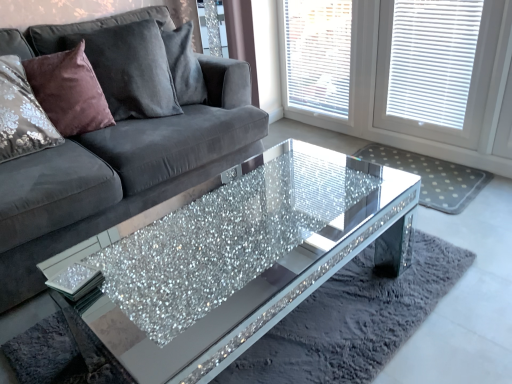
Find the location of `white mesh screen at upper right`. white mesh screen at upper right is located at coordinates (318, 55).

Image resolution: width=512 pixels, height=384 pixels. What do you see at coordinates (232, 258) in the screenshot? I see `sparkly glass coffee table at center` at bounding box center [232, 258].

The width and height of the screenshot is (512, 384). Find the location of `sparkly glass coffee table at center`. sparkly glass coffee table at center is located at coordinates (232, 258).

Where is `white textured blinds at upper right`? The height and width of the screenshot is (384, 512). white textured blinds at upper right is located at coordinates (388, 80).

Describe the element at coordinates (388, 80) in the screenshot. The width and height of the screenshot is (512, 384). I see `white textured blinds at upper right` at that location.

You are a GUI agent. You are given a task and a screenshot of the screen. Output one action in this format:
    pyautogui.click(x=<x>, y=<y>)
    Task: Click on the velvet grey couch at center
    
    Given the screenshot: What is the action you would take?
    pyautogui.click(x=123, y=141)

Find the location of a particular element. white mesh screen at upper right is located at coordinates (318, 55).

Is white textured blind at upper right at the right side of white textured blinds at upper right?

Indeed, white textured blind at upper right is positioned on the right side of white textured blinds at upper right.

Is point (457, 2) positioned behind point (510, 19)?

Yes, it is behind point (510, 19).

Are white textured blind at upper right and white textured blinds at upper right located far from each other?

That's not correct — white textured blind at upper right is a little close to white textured blinds at upper right.

From a real-world perspective, is white mesh screen at upper right physically below white textured blinds at upper right?

No, from a real-world perspective, white mesh screen at upper right is not under white textured blinds at upper right.

Between white mesh screen at upper right and white textured blinds at upper right, which one has larger width?

Wider between the two is white textured blinds at upper right.

Can we say white mesh screen at upper right lies outside white textured blinds at upper right?

Yes, white mesh screen at upper right is not within white textured blinds at upper right.

How many degrees apart are the facing directions of white mesh screen at upper right and white textured blinds at upper right?

There is a 1.18-degree angle between the facing directions of white mesh screen at upper right and white textured blinds at upper right.

Starting from the sparkly glass coffee table at center, which pillow is the 2nd one behind? Please provide its 2D coordinates.

[(121, 64)]

Considering the positions of objects sparkly glass coffee table at center and velvet/maroon pillow at left, the 2th pillow viewed from the left, in the image provided, who is in front, sparkly glass coffee table at center or velvet/maroon pillow at left, the 2th pillow viewed from the left,?

Positioned in front is sparkly glass coffee table at center.

Which point is more forward, [397,242] or [135,108]?

The point [397,242] is more forward.

Which object is thinner, sparkly glass coffee table at center or velvet/maroon pillow at left, which is the 1th pillow in right-to-left order?

velvet/maroon pillow at left, which is the 1th pillow in right-to-left order, is thinner.

From the picture: From the image's perspective, is white textured blind at upper right below sparkly glass coffee table at center?

No, from the image's perspective, white textured blind at upper right is not beneath sparkly glass coffee table at center.

Based on the photo, between white textured blind at upper right and sparkly glass coffee table at center, which one has larger width?

With larger width is sparkly glass coffee table at center.

Is white textured blind at upper right next to sparkly glass coffee table at center and touching it?

white textured blind at upper right and sparkly glass coffee table at center are clearly separated.

Does white textured blinds at upper right have a lesser width compared to sparkly glass coffee table at center?

Indeed, white textured blinds at upper right has a lesser width compared to sparkly glass coffee table at center.

Between white textured blinds at upper right and sparkly glass coffee table at center, which one has smaller size?

white textured blinds at upper right.

From the picture: Which is more to the left, white textured blinds at upper right or sparkly glass coffee table at center?

Positioned to the left is sparkly glass coffee table at center.

Is white textured blinds at upper right far from sparkly glass coffee table at center?

No, white textured blinds at upper right is not far from sparkly glass coffee table at center.

Could white mesh screen at upper right be considered to be inside sparkly glass coffee table at center?

Definitely not — white mesh screen at upper right is not inside sparkly glass coffee table at center.

Between sparkly glass coffee table at center and white mesh screen at upper right, which one has smaller size?

With smaller size is white mesh screen at upper right.

Considering the relative positions of sparkly glass coffee table at center and white mesh screen at upper right in the image provided, is sparkly glass coffee table at center to the left or to the right of white mesh screen at upper right?

Based on their positions, sparkly glass coffee table at center is located to the left of white mesh screen at upper right.

From a real-world perspective, is sparkly glass coffee table at center physically located above or below white mesh screen at upper right?

From a real-world perspective, sparkly glass coffee table at center is physically below white mesh screen at upper right.

Looking at this image, considering the sizes of velvet/maroon pillow at upper left, the 2th pillow in the right-to-left sequence, and velvet grey couch at center in the image, is velvet/maroon pillow at upper left, the 2th pillow in the right-to-left sequence, wider or thinner than velvet grey couch at center?

velvet/maroon pillow at upper left, the 2th pillow in the right-to-left sequence, is thinner than velvet grey couch at center.

Are velvet/maroon pillow at upper left, marked as the first pillow in a left-to-right arrangement, and velvet grey couch at center located far from each other?

velvet/maroon pillow at upper left, marked as the first pillow in a left-to-right arrangement, is near velvet grey couch at center, not far away.

Who is smaller, velvet/maroon pillow at upper left, the 2th pillow in the right-to-left sequence, or velvet grey couch at center?

With smaller size is velvet/maroon pillow at upper left, the 2th pillow in the right-to-left sequence.

Consider the image. Measure the distance between velvet/maroon pillow at upper left, the 2th pillow in the right-to-left sequence, and velvet grey couch at center.

The distance of velvet/maroon pillow at upper left, the 2th pillow in the right-to-left sequence, from velvet grey couch at center is 10.82 inches.

This screenshot has width=512, height=384. In order to click on window located on the left of white textured blind at upper right in this screenshot , I will do `click(388, 80)`.

The width and height of the screenshot is (512, 384). What are the coordinates of `window screen behind the white textured blinds at upper right` in the screenshot? It's located at (318, 55).

From the image, which object appears to be nearer to sparkly glass coffee table at center, velvet grey couch at center or white textured blinds at upper right?

Based on the image, velvet grey couch at center appears to be nearer to sparkly glass coffee table at center.

Based on the photo, considering their positions, is velvet/maroon pillow at upper left, marked as the first pillow in a left-to-right arrangement, positioned further to white textured blinds at upper right than white mesh screen at upper right?

Based on the image, velvet/maroon pillow at upper left, marked as the first pillow in a left-to-right arrangement, appears to be further to white textured blinds at upper right.

Estimate the real-world distances between objects in this image. Which object is further from velvet grey couch at center, white mesh screen at upper right or velvet/maroon pillow at upper left, marked as the first pillow in a left-to-right arrangement?

white mesh screen at upper right is further to velvet grey couch at center.

From the image, which object appears to be farther from velvet/maroon pillow at upper left, marked as the first pillow in a left-to-right arrangement, velvet grey couch at center or velvet/maroon pillow at left, the 2th pillow viewed from the left?

The object further to velvet/maroon pillow at upper left, marked as the first pillow in a left-to-right arrangement, is velvet grey couch at center.

Looking at the image, which one is located further to velvet grey couch at center, white dotted mat at center or velvet/maroon pillow at upper left, marked as the first pillow in a left-to-right arrangement?

Based on the image, white dotted mat at center appears to be further to velvet grey couch at center.

When comparing their distances from white dotted mat at center, does white textured blinds at upper right or velvet grey couch at center seem further?

velvet grey couch at center lies further to white dotted mat at center than the other object.

Based on their spatial positions, is sparkly glass coffee table at center or white dotted mat at center further from white textured blinds at upper right?

sparkly glass coffee table at center is positioned further to the anchor white textured blinds at upper right.

Which object lies further to the anchor point velvet/maroon pillow at upper left, marked as the first pillow in a left-to-right arrangement, velvet/maroon pillow at left, which is the 1th pillow in right-to-left order, or white dotted mat at center?

white dotted mat at center is positioned further to the anchor velvet/maroon pillow at upper left, marked as the first pillow in a left-to-right arrangement.

Find the location of a particular element. pillow between sparkly glass coffee table at center and velvet/maroon pillow at left, which is the 1th pillow in right-to-left order, in the front-back direction is located at coordinates (69, 91).

You are a GUI agent. You are given a task and a screenshot of the screen. Output one action in this format:
    pyautogui.click(x=<x>, y=<y>)
    Task: Click on the window between white textured blind at upper right and white dotted mat at center vertically
    
    Given the screenshot: What is the action you would take?
    pyautogui.click(x=388, y=80)

This screenshot has width=512, height=384. I want to click on studio couch between velvet/maroon pillow at upper left, the 2th pillow in the right-to-left sequence, and white textured blinds at upper right, in the horizontal direction, so click(123, 141).

At what (x,y) coordinates should I click in order to perform the action: click on window screen between velvet/maroon pillow at left, the 2th pillow viewed from the left, and white textured blinds at upper right. Please return your answer as a coordinate pair (x, y). This screenshot has width=512, height=384. Looking at the image, I should click on (318, 55).